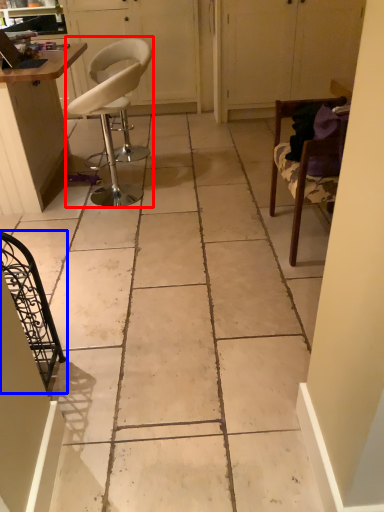
Question: Which object is closer to the camera taking this photo, chair (highlighted by a red box) or chair (highlighted by a blue box)?

Choices:
 (A) chair
 (B) chair

Answer: (B)